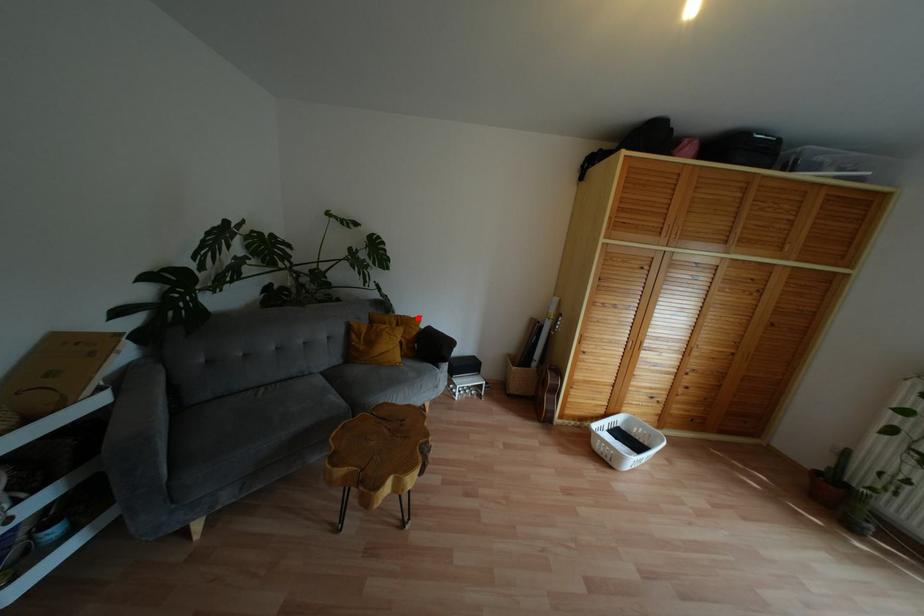
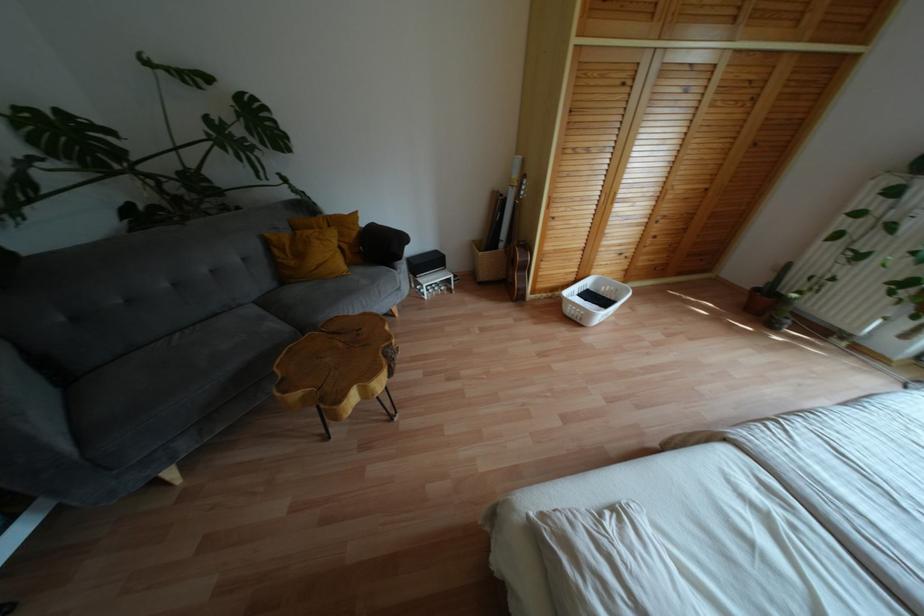
The point at the highlighted location is marked in the first image. Where is the corresponding point in the second image?

(354, 214)